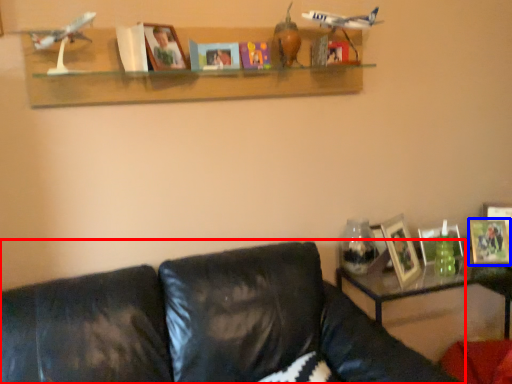
Question: Which object is closer to the camera taking this photo, studio couch (highlighted by a red box) or picture frame (highlighted by a blue box)?

Choices:
 (A) studio couch
 (B) picture frame

Answer: (A)